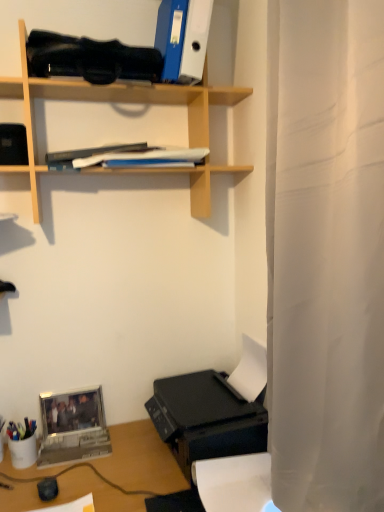
Question: Is blue matte book at upper center surrounded by black plastic printer at lower right?

Choices:
 (A) yes
 (B) no

Answer: (B)

Question: Can you confirm if black plastic printer at lower right is shorter than blue matte book at upper center?

Choices:
 (A) no
 (B) yes

Answer: (A)

Question: From a real-world perspective, does black plastic printer at lower right sit lower than blue matte book at upper center?

Choices:
 (A) yes
 (B) no

Answer: (A)

Question: Can you confirm if black plastic printer at lower right is thinner than blue matte book at upper center?

Choices:
 (A) yes
 (B) no

Answer: (B)

Question: Does black plastic printer at lower right have a smaller size compared to blue matte book at upper center?

Choices:
 (A) no
 (B) yes

Answer: (A)

Question: Is the depth of black plastic printer at lower right less than that of blue matte book at upper center?

Choices:
 (A) no
 (B) yes

Answer: (B)

Question: Considering the relative sizes of multicolored plastic pen holder at lower left and wooden shelf at upper center in the image provided, is multicolored plastic pen holder at lower left smaller than wooden shelf at upper center?

Choices:
 (A) yes
 (B) no

Answer: (A)

Question: From the image's perspective, is multicolored plastic pen holder at lower left located above wooden shelf at upper center?

Choices:
 (A) yes
 (B) no

Answer: (B)

Question: Considering the relative sizes of multicolored plastic pen holder at lower left and wooden shelf at upper center in the image provided, is multicolored plastic pen holder at lower left shorter than wooden shelf at upper center?

Choices:
 (A) no
 (B) yes

Answer: (B)

Question: Can you confirm if multicolored plastic pen holder at lower left is wider than wooden shelf at upper center?

Choices:
 (A) yes
 (B) no

Answer: (B)

Question: Can you confirm if multicolored plastic pen holder at lower left is taller than wooden shelf at upper center?

Choices:
 (A) no
 (B) yes

Answer: (A)

Question: Is wooden shelf at upper center completely or partially inside multicolored plastic pen holder at lower left?

Choices:
 (A) yes
 (B) no

Answer: (B)

Question: Is black plastic printer at lower right to the right of metallic silver laptop at lower left from the viewer's perspective?

Choices:
 (A) no
 (B) yes

Answer: (B)